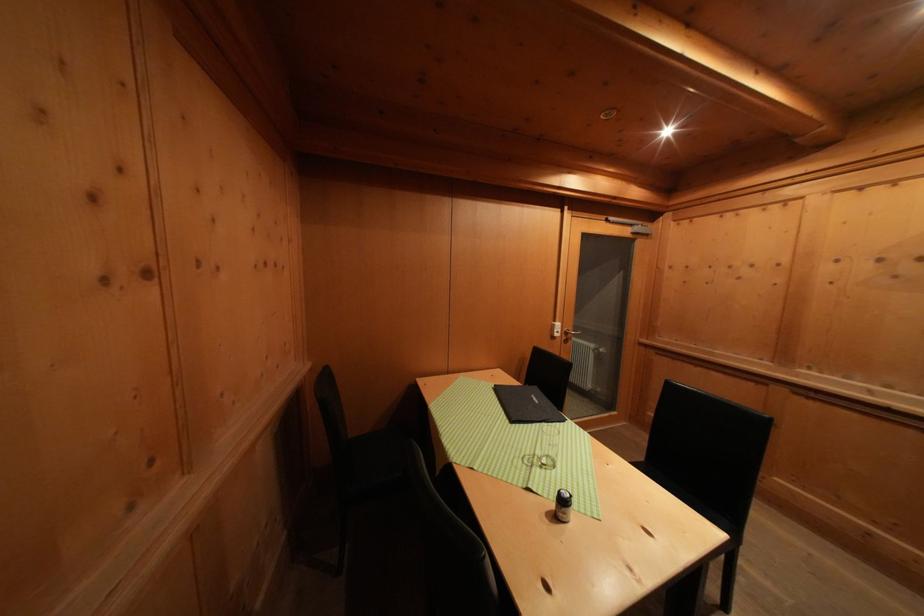
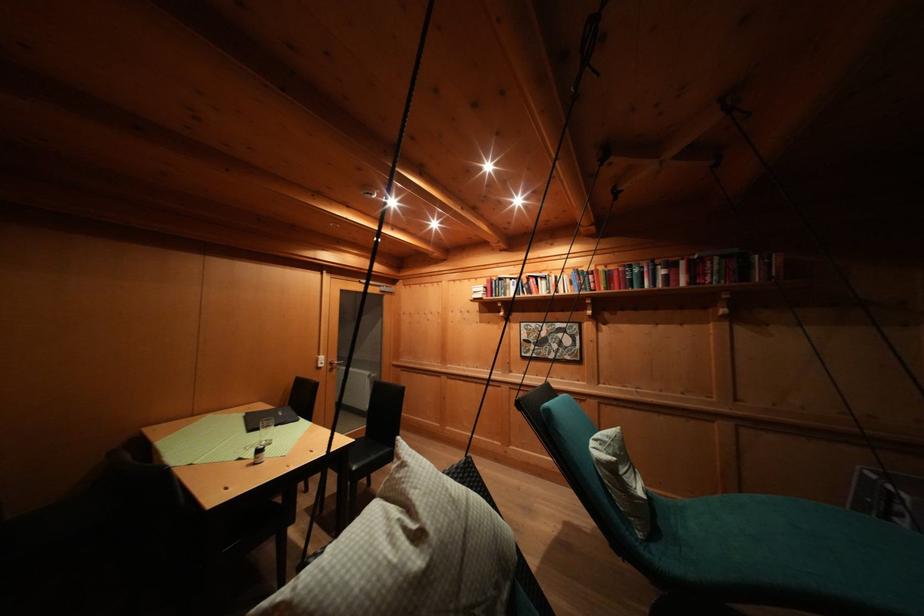
In the second image, find the point that corresponds to (564,330) in the first image.

(327, 362)